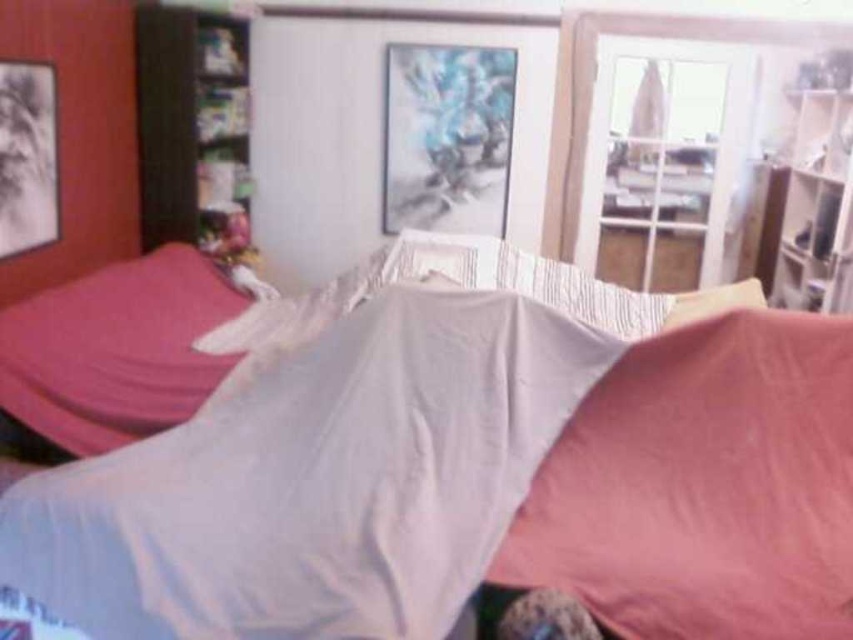
Does white fabric sheet at center lie behind pink fabric pillow at lower right?

No.

This screenshot has height=640, width=853. What do you see at coordinates (316, 483) in the screenshot? I see `white fabric sheet at center` at bounding box center [316, 483].

Locate an element on the screen. Image resolution: width=853 pixels, height=640 pixels. white fabric sheet at center is located at coordinates (316, 483).

Is pink fabric pillow at lower right wider than pink fabric pillow at left?

Correct, the width of pink fabric pillow at lower right exceeds that of pink fabric pillow at left.

Can you confirm if pink fabric pillow at lower right is thinner than pink fabric pillow at left?

No.

The image size is (853, 640). Describe the element at coordinates (704, 486) in the screenshot. I see `pink fabric pillow at lower right` at that location.

This screenshot has width=853, height=640. I want to click on pink fabric pillow at lower right, so click(x=704, y=486).

Based on the photo, is white fabric sheet at center positioned behind pink fabric pillow at left?

No.

Can you confirm if white fabric sheet at center is wider than pink fabric pillow at left?

Indeed, white fabric sheet at center has a greater width compared to pink fabric pillow at left.

Is point (183, 461) farther from camera compared to point (148, 332)?

No, (183, 461) is in front of (148, 332).

Identify the location of white fabric sheet at center. The width and height of the screenshot is (853, 640). (316, 483).